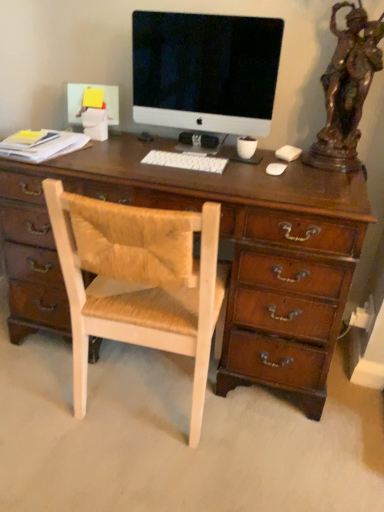
What do you see at coordinates (205, 71) in the screenshot?
I see `satin black monitor at center` at bounding box center [205, 71].

What is the approximate height of satin black monitor at center?

satin black monitor at center is 19.12 inches in height.

Find the location of `bronze statue at right`. bronze statue at right is located at coordinates (346, 90).

Considering their positions, is bronze statue at right located in front of or behind satin black monitor at center?

In the image, bronze statue at right appears in front of satin black monitor at center.

Which object is thinner, bronze statue at right or satin black monitor at center?

satin black monitor at center is thinner.

Between point (354, 37) and point (145, 40), which one is positioned in front?

The point (354, 37) is closer.

In the image, there is a bronze statue at right. Where is `computer monitor below it (from a real-world perspective)`? computer monitor below it (from a real-world perspective) is located at coordinates (205, 71).

Which is behind, point (147, 159) or point (160, 252)?

Positioned behind is point (147, 159).

Who is bigger, white plastic keyboard at center or light wood woven chair at center?

With larger size is light wood woven chair at center.

From the image's perspective, is white plastic keyboard at center located above or below light wood woven chair at center?

white plastic keyboard at center is above light wood woven chair at center.

In terms of width, does white plastic keyboard at center look wider or thinner when compared to light wood woven chair at center?

Considering their sizes, white plastic keyboard at center looks slimmer than light wood woven chair at center.

How many degrees apart are the facing directions of bronze statue at right and white plastic keyboard at center?

There is a 1.66-degree angle between the facing directions of bronze statue at right and white plastic keyboard at center.

Are bronze statue at right and white plastic keyboard at center far apart?

bronze statue at right is near white plastic keyboard at center, not far away.

Could you tell me if bronze statue at right is facing white plastic keyboard at center?

No.

Is bronze statue at right further to the viewer compared to white plastic keyboard at center?

No, bronze statue at right is in front of white plastic keyboard at center.

From a real-world perspective, does satin black monitor at center sit lower than white plastic keyboard at center?

No, from a real-world perspective, satin black monitor at center is not under white plastic keyboard at center.

Is satin black monitor at center situated inside white plastic keyboard at center or outside?

satin black monitor at center is spatially situated outside white plastic keyboard at center.

Does point (171, 24) come in front of point (166, 165)?

No, (171, 24) is further to viewer.

Is bronze statue at right thinner than light wood woven chair at center?

Yes.

From a real-world perspective, between bronze statue at right and light wood woven chair at center, who is vertically lower?

light wood woven chair at center, from a real-world perspective.

How different are the orientations of bronze statue at right and light wood woven chair at center in degrees?

There is a 178-degree angle between the facing directions of bronze statue at right and light wood woven chair at center.

Based on the photo, considering the relative positions of bronze statue at right and light wood woven chair at center in the image provided, is bronze statue at right to the right of light wood woven chair at center from the viewer's perspective?

Indeed, bronze statue at right is positioned on the right side of light wood woven chair at center.

Based on the photo, is white plastic keyboard at center at the left side of satin black monitor at center?

Indeed, white plastic keyboard at center is positioned on the left side of satin black monitor at center.

Which object is closer to the camera, white plastic keyboard at center or satin black monitor at center?

satin black monitor at center is in front.

In the scene shown: Could you tell me if white plastic keyboard at center is turned towards satin black monitor at center?

No, white plastic keyboard at center does not turn towards satin black monitor at center.

Is white plastic keyboard at center wider than satin black monitor at center?

Yes, white plastic keyboard at center is wider than satin black monitor at center.

Considering the relative sizes of light wood woven chair at center and bronze statue at right in the image provided, is light wood woven chair at center shorter than bronze statue at right?

No, light wood woven chair at center is not shorter than bronze statue at right.

Can you confirm if light wood woven chair at center is positioned to the left of bronze statue at right?

Indeed, light wood woven chair at center is positioned on the left side of bronze statue at right.

In the image, is light wood woven chair at center positioned in front of or behind bronze statue at right?

light wood woven chair at center is positioned closer to the viewer than bronze statue at right.

Where is `computer monitor above the bronze statue at right (from the image's perspective)`? The width and height of the screenshot is (384, 512). computer monitor above the bronze statue at right (from the image's perspective) is located at coordinates (205, 71).

Locate an element on the screen. This screenshot has height=512, width=384. chair that appears below the white plastic keyboard at center (from the image's perspective) is located at coordinates (140, 282).

Which object lies nearer to the anchor point light wood woven chair at center, white plastic keyboard at center or satin black monitor at center?

white plastic keyboard at center lies closer to light wood woven chair at center than the other object.

Based on their spatial positions, is white plastic keyboard at center or bronze statue at right closer to satin black monitor at center?

white plastic keyboard at center is positioned closer to the anchor satin black monitor at center.

From the image, which object appears to be farther from bronze statue at right, light wood woven chair at center or satin black monitor at center?

The object further to bronze statue at right is light wood woven chair at center.

From the image, which object appears to be nearer to satin black monitor at center, light wood woven chair at center or white plastic keyboard at center?

white plastic keyboard at center lies closer to satin black monitor at center than the other object.

From the image, which object appears to be nearer to satin black monitor at center, light wood woven chair at center or bronze statue at right?

bronze statue at right lies closer to satin black monitor at center than the other object.

Based on the photo, looking at the image, which one is located further to bronze statue at right, white plastic keyboard at center or satin black monitor at center?

white plastic keyboard at center is positioned further to the anchor bronze statue at right.

Considering their positions, is bronze statue at right positioned further to white plastic keyboard at center than light wood woven chair at center?

bronze statue at right is further to white plastic keyboard at center.

From the image, which object appears to be farther from white plastic keyboard at center, satin black monitor at center or light wood woven chair at center?

light wood woven chair at center lies further to white plastic keyboard at center than the other object.

Image resolution: width=384 pixels, height=512 pixels. Find the location of `computer keyboard between satin black monitor at center and light wood woven chair at center vertically`. computer keyboard between satin black monitor at center and light wood woven chair at center vertically is located at coordinates (186, 161).

Identify the location of computer monitor between white plastic keyboard at center and bronze statue at right from left to right. (205, 71).

Identify the location of computer keyboard between bronze statue at right and light wood woven chair at center in the vertical direction. This screenshot has width=384, height=512. (186, 161).

The image size is (384, 512). In order to click on bronze statue between satin black monitor at center and light wood woven chair at center vertically in this screenshot , I will do `click(346, 90)`.